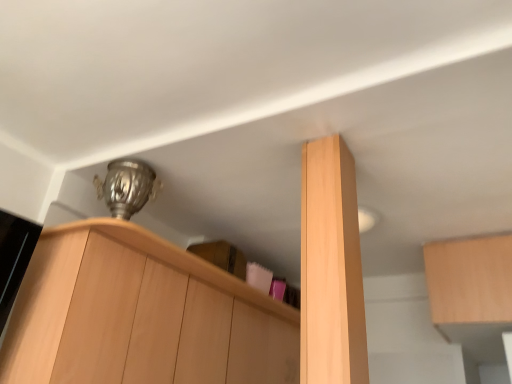
Question: Is light wood cabinet at upper right, the first cabinetry positioned from the right, facing towards light wood cabinet at center, the second cabinetry when ordered from right to left?

Choices:
 (A) no
 (B) yes

Answer: (B)

Question: Would you consider light wood cabinet at upper right, the first cabinetry positioned from the right, to be distant from light wood cabinet at center, the second cabinetry when ordered from right to left?

Choices:
 (A) no
 (B) yes

Answer: (B)

Question: Can you confirm if light wood cabinet at upper right, the first cabinetry positioned from the right, is shorter than light wood cabinet at center, acting as the second cabinetry starting from the left?

Choices:
 (A) no
 (B) yes

Answer: (B)

Question: Considering the relative sizes of light wood cabinet at upper right, the first cabinetry positioned from the right, and light wood cabinet at center, acting as the second cabinetry starting from the left, in the image provided, is light wood cabinet at upper right, the first cabinetry positioned from the right, wider than light wood cabinet at center, acting as the second cabinetry starting from the left,?

Choices:
 (A) no
 (B) yes

Answer: (B)

Question: Can you confirm if light wood cabinet at upper right, placed as the 3th cabinetry when sorted from left to right, is bigger than light wood cabinet at center, acting as the second cabinetry starting from the left?

Choices:
 (A) no
 (B) yes

Answer: (B)

Question: Considering the positions of light wood cabinet at upper left, the first cabinetry viewed from the left, and light wood cabinet at upper right, the first cabinetry positioned from the right, in the image, is light wood cabinet at upper left, the first cabinetry viewed from the left, wider or thinner than light wood cabinet at upper right, the first cabinetry positioned from the right,?

Choices:
 (A) thin
 (B) wide

Answer: (A)

Question: Is point (233, 322) closer or farther from the camera than point (443, 268)?

Choices:
 (A) closer
 (B) farther

Answer: (B)

Question: Based on their positions, is light wood cabinet at upper left, which is the 3th cabinetry in right-to-left order, located to the left or right of light wood cabinet at upper right, placed as the 3th cabinetry when sorted from left to right?

Choices:
 (A) right
 (B) left

Answer: (B)

Question: From a real-world perspective, relative to light wood cabinet at upper right, the first cabinetry positioned from the right, is light wood cabinet at upper left, the first cabinetry viewed from the left, vertically above or below?

Choices:
 (A) above
 (B) below

Answer: (B)

Question: Is light wood cabinet at upper right, placed as the 3th cabinetry when sorted from left to right, taller or shorter than light wood cabinet at upper left, the first cabinetry viewed from the left?

Choices:
 (A) tall
 (B) short

Answer: (B)

Question: From a real-world perspective, is light wood cabinet at upper right, the first cabinetry positioned from the right, above or below light wood cabinet at upper left, which is the 3th cabinetry in right-to-left order?

Choices:
 (A) below
 (B) above

Answer: (B)

Question: Considering the relative positions of light wood cabinet at upper right, the first cabinetry positioned from the right, and light wood cabinet at upper left, the first cabinetry viewed from the left, in the image provided, is light wood cabinet at upper right, the first cabinetry positioned from the right, to the left or to the right of light wood cabinet at upper left, the first cabinetry viewed from the left,?

Choices:
 (A) right
 (B) left

Answer: (A)

Question: Which is correct: light wood cabinet at upper right, the first cabinetry positioned from the right, is inside light wood cabinet at upper left, the first cabinetry viewed from the left, or outside of it?

Choices:
 (A) outside
 (B) inside

Answer: (A)

Question: Based on their sizes in the image, would you say light wood cabinet at upper right, the first cabinetry positioned from the right, is bigger or smaller than light wood cabinet at center, acting as the second cabinetry starting from the left?

Choices:
 (A) small
 (B) big

Answer: (B)

Question: Is light wood cabinet at upper right, the first cabinetry positioned from the right, in front of or behind light wood cabinet at center, acting as the second cabinetry starting from the left, in the image?

Choices:
 (A) front
 (B) behind

Answer: (B)